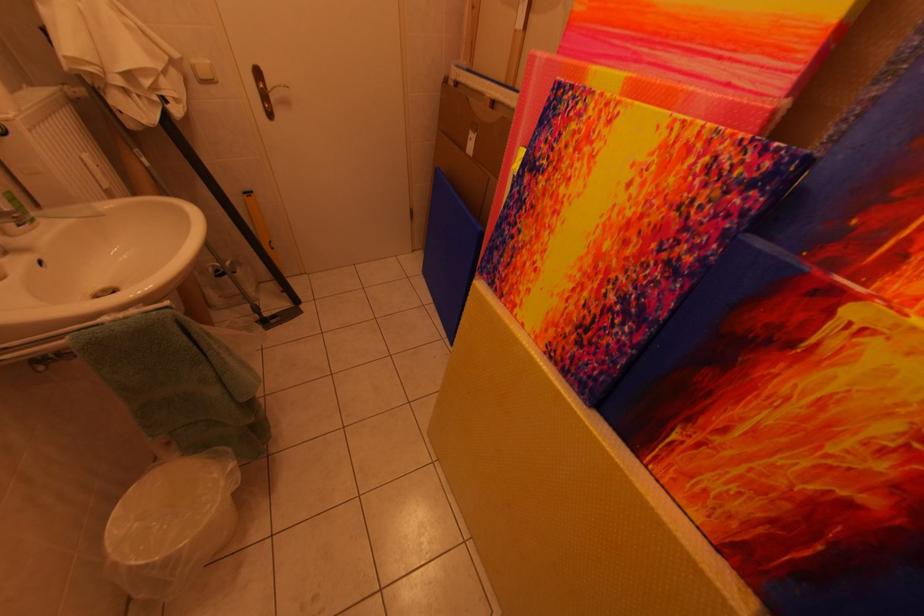
Describe the element at coordinates (599, 225) in the screenshot. I see `a yellow art canvas` at that location.